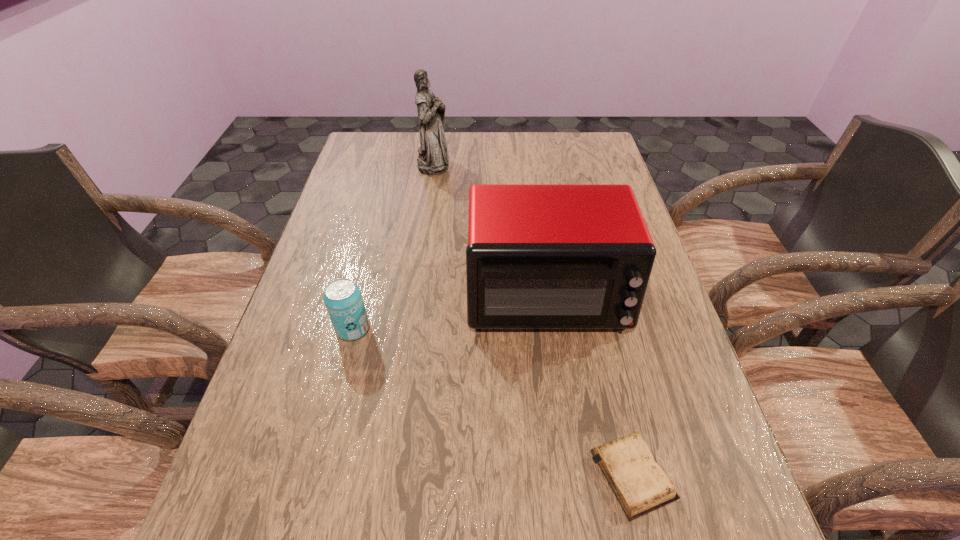
The height and width of the screenshot is (540, 960). I want to click on vacant space that's between the third tallest object and the farthest object, so click(x=394, y=246).

Identify the location of free area in between the third shortest object and the beer can. The height and width of the screenshot is (540, 960). (449, 312).

Locate an element on the screen. empty space that is in between the shortest object and the toaster oven is located at coordinates (589, 384).

This screenshot has height=540, width=960. In order to click on free space between the second tallest object and the beer can in this screenshot , I will do `click(449, 312)`.

The image size is (960, 540). I want to click on free space between the figurine and the leftmost object, so click(394, 246).

Select which object appears as the second closest to the second shortest object. Please provide its 2D coordinates. Your answer should be formatted as a tuple, i.e. [(x, y)], where the tuple contains the x and y coordinates of a point satisfying the conditions above.

[(640, 484)]

Locate which object ranks third in proximity to the shortest object. Please provide its 2D coordinates. Your answer should be formatted as a tuple, i.e. [(x, y)], where the tuple contains the x and y coordinates of a point satisfying the conditions above.

[(432, 159)]

What are the coordinates of `vacant region that satisfies the following two spatial constraints: 1. on the front-facing side of the third shortest object; 2. on the right side of the diary` in the screenshot? It's located at (570, 474).

This screenshot has height=540, width=960. What are the coordinates of `vacant position in the image that satisfies the following two spatial constraints: 1. on the back side of the diary; 2. on the front-facing side of the figurine` in the screenshot? It's located at (560, 163).

At what (x,y) coordinates should I click in order to perform the action: click on vacant area in the image that satisfies the following two spatial constraints: 1. on the front side of the third tallest object; 2. on the right side of the nearest object. Please return your answer as a coordinate pair (x, y). Looking at the image, I should click on (317, 474).